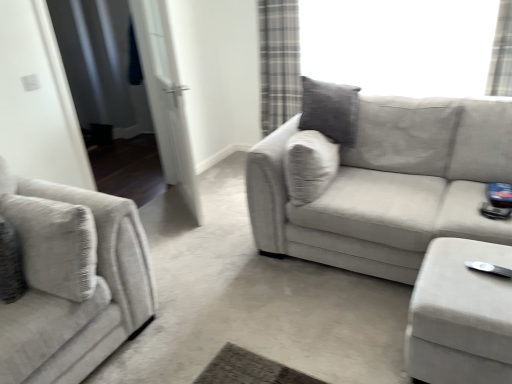
You are a GUI agent. You are given a task and a screenshot of the screen. Output one action in this format:
    pyautogui.click(x=<x>, y=<y>)
    Task: Click on the vacant space positioned to the left of white plastic wii controller at lower right
    The height and width of the screenshot is (384, 512).
    Given the screenshot: What is the action you would take?
    pyautogui.click(x=454, y=278)